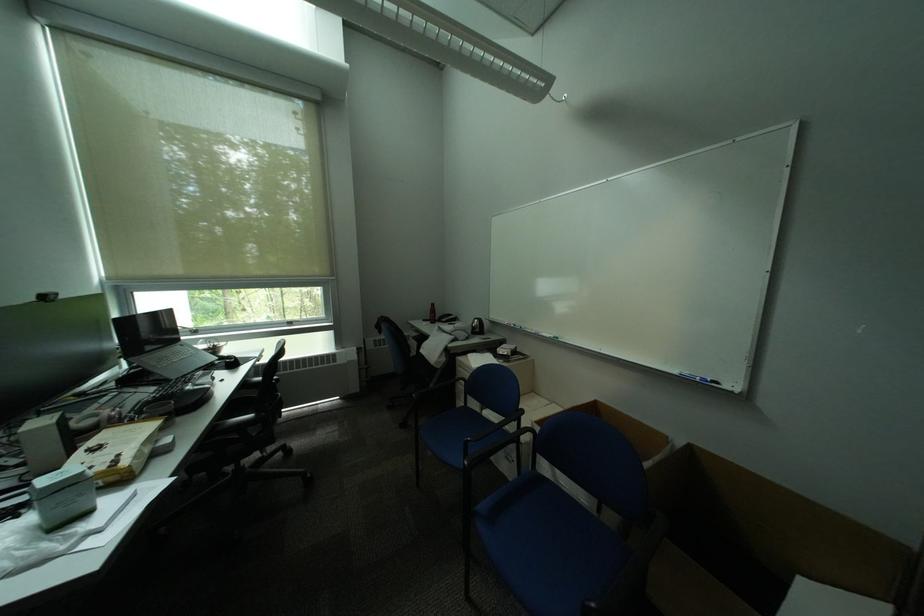
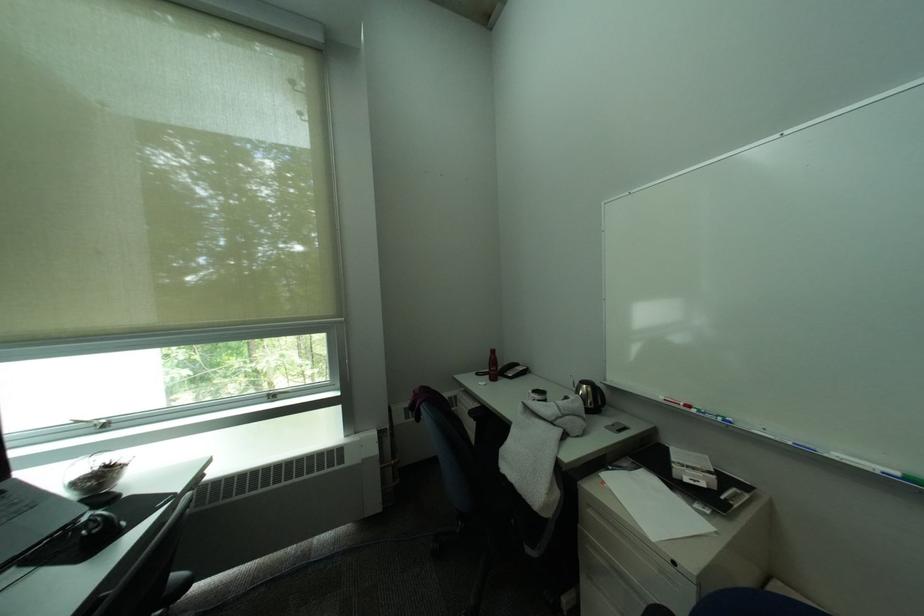
Where in the second image is the point corresponding to (x=434, y=322) from the first image?

(488, 376)